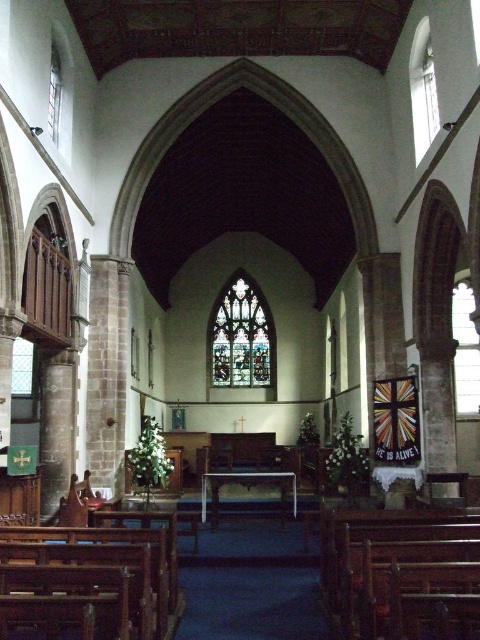
You are standing in the nave of the church and looking towards the altar. There is a point marked at coordinates [465,349]. What object does this point correspond to?

The point corresponds to the clear stained glass window at upper right.